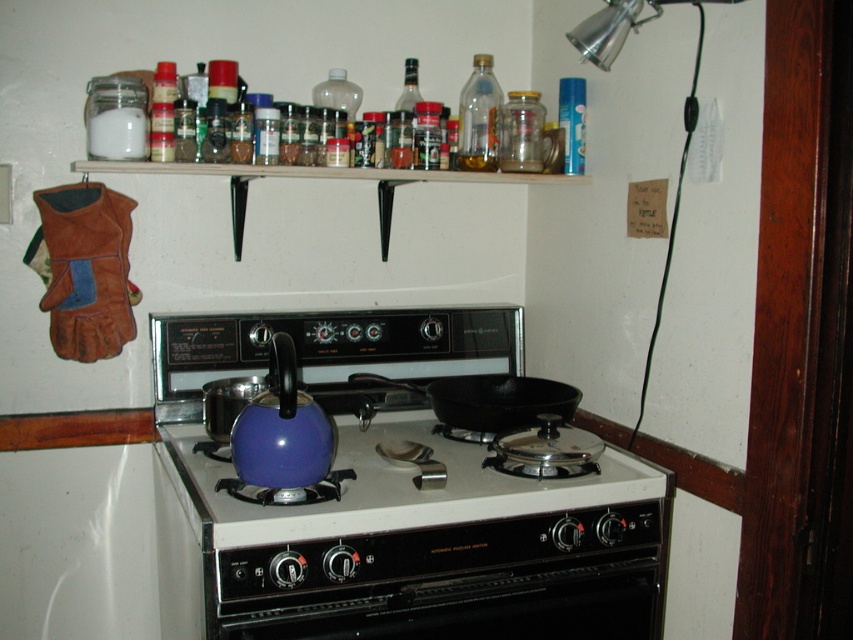
Does black matte oven at center appear over glossy enamel teapot at center?

No, black matte oven at center is not above glossy enamel teapot at center.

What do you see at coordinates (454, 580) in the screenshot?
I see `black matte oven at center` at bounding box center [454, 580].

Between point (316, 600) and point (231, 444), which one is positioned behind?

The point (231, 444) is more distant.

Image resolution: width=853 pixels, height=640 pixels. In order to click on black matte oven at center in this screenshot , I will do `click(454, 580)`.

Does point (645, 548) lie behind point (260, 419)?

That is True.

Can you confirm if matte blue kettle at center is thinner than glossy enamel teapot at center?

No.

You are a GUI agent. You are given a task and a screenshot of the screen. Output one action in this format:
    pyautogui.click(x=<x>, y=<y>)
    Task: Click on the matte blue kettle at center
    
    Given the screenshot: What is the action you would take?
    pyautogui.click(x=392, y=497)

Image resolution: width=853 pixels, height=640 pixels. Identify the location of matte blue kettle at center. (392, 497).

Does matte blue kettle at center have a lesser height compared to transparent plastic bottle at upper center?

No.

Who is more distant from viewer, (299, 332) or (457, 124)?

The point (457, 124) is more distant.

Is point (347, 589) in front of point (479, 72)?

Yes, point (347, 589) is in front of point (479, 72).

This screenshot has width=853, height=640. Identify the location of matte blue kettle at center. (392, 497).